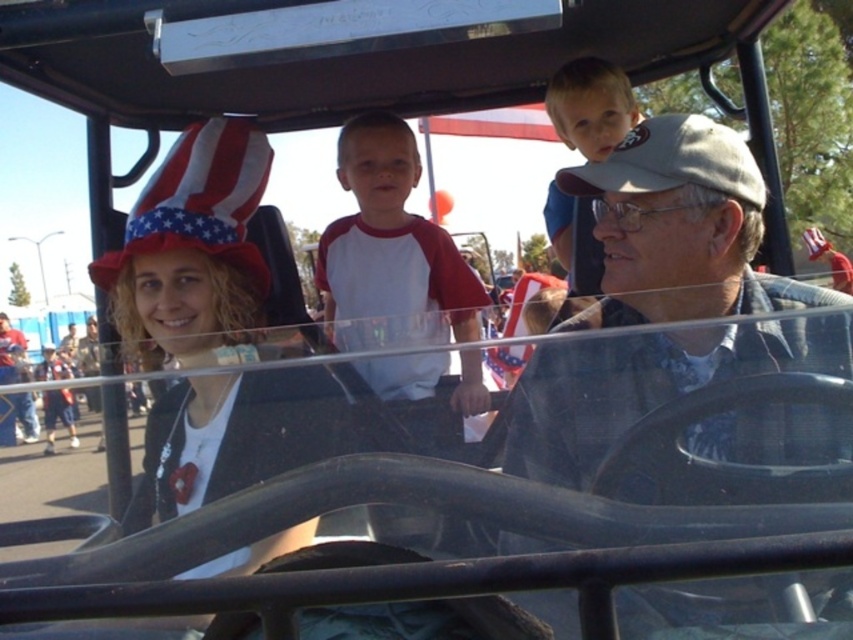
Question: Does blue denim shirt at center appear under white/red raglan shirt at center?

Choices:
 (A) yes
 (B) no

Answer: (A)

Question: Which is farther from the blue denim shirt at center?

Choices:
 (A) matte white shirt at center
 (B) light brown hair at upper center
 (C) white/red raglan shirt at center

Answer: (A)

Question: Does white/red raglan shirt at center appear on the left side of matte white shirt at center?

Choices:
 (A) yes
 (B) no

Answer: (B)

Question: Which point is closer to the camera taking this photo?

Choices:
 (A) (567, 268)
 (B) (459, 321)

Answer: (B)

Question: Which object is closer to the camera taking this photo?

Choices:
 (A) blue denim shirt at center
 (B) matte white shirt at center
 (C) light brown hair at upper center
 (D) white/red raglan shirt at center

Answer: (A)

Question: Can you confirm if blue denim shirt at center is positioned below white/red raglan shirt at center?

Choices:
 (A) no
 (B) yes

Answer: (B)